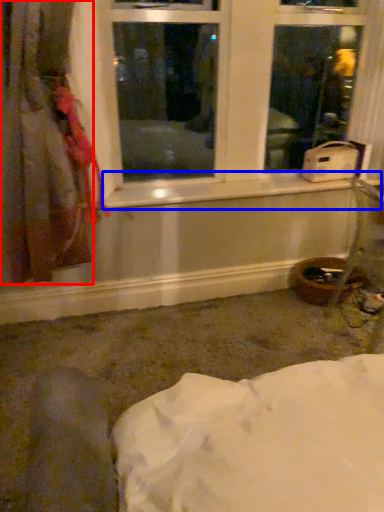
Question: Which point is further to the camera, curtain (highlighted by a red box) or window sill (highlighted by a blue box)?

Choices:
 (A) curtain
 (B) window sill

Answer: (B)